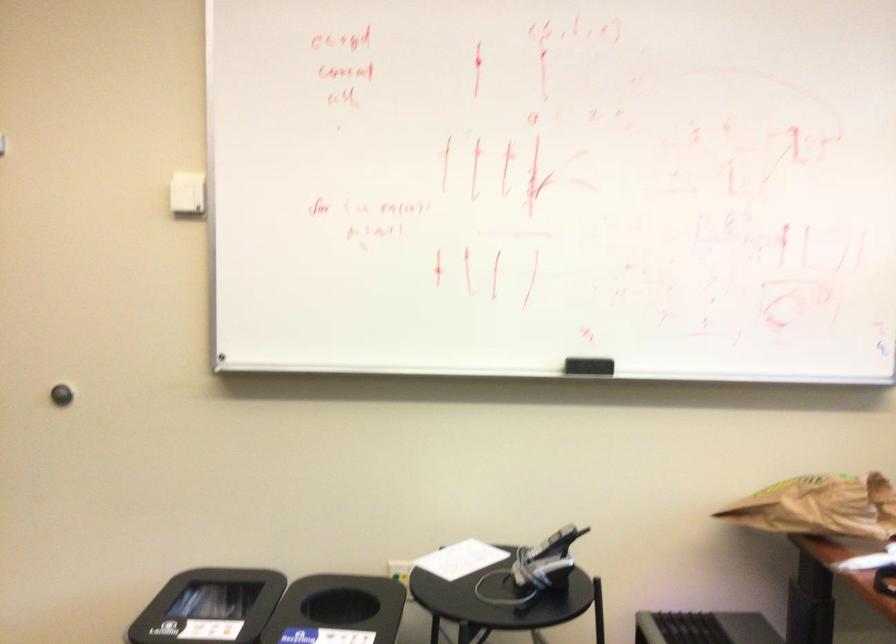
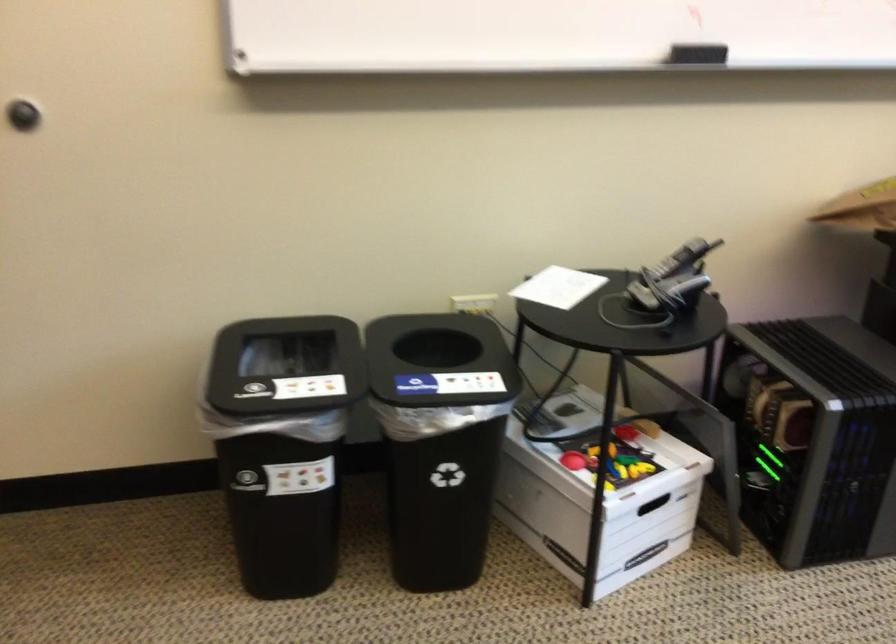
Which direction would the cameraman need to move to produce the second image?

The cameraman moved toward left, forward.